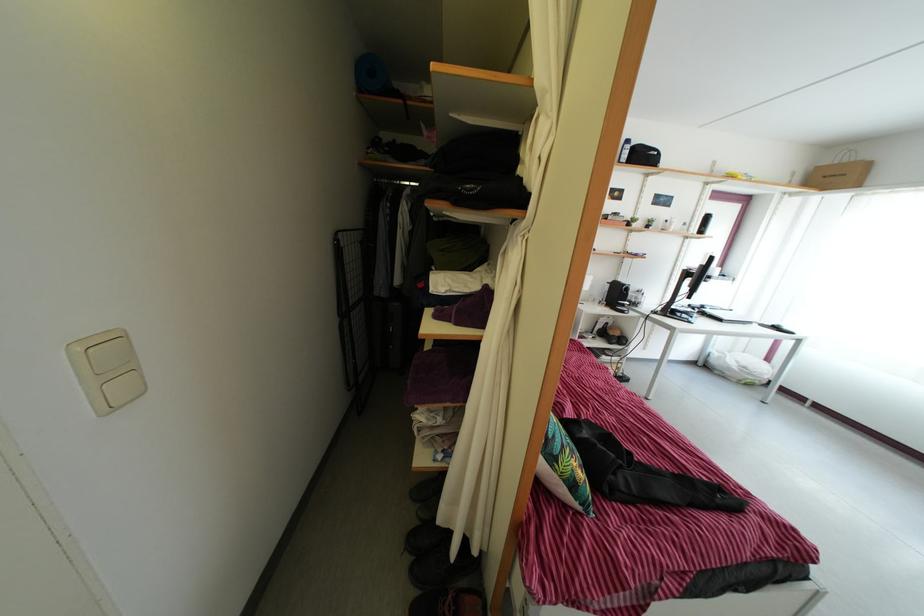
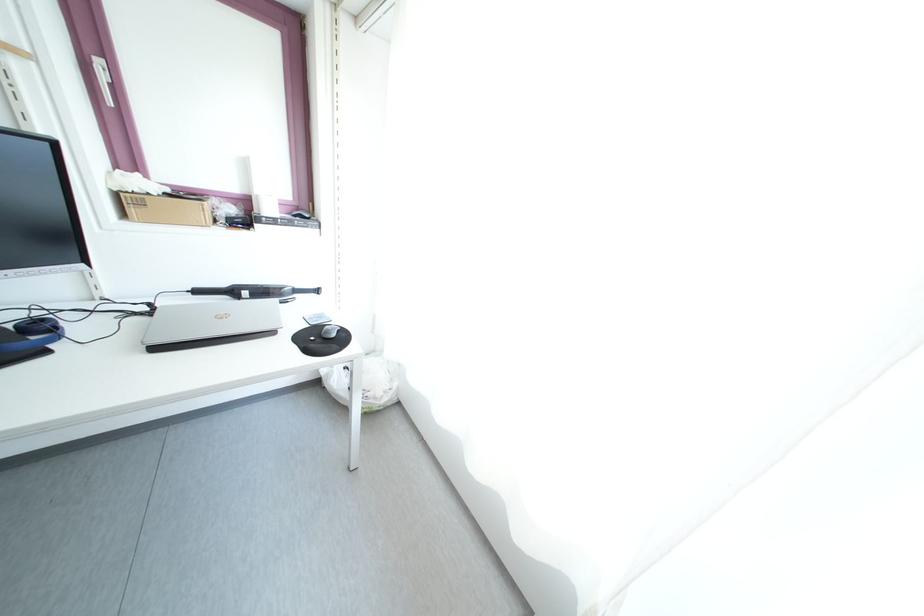
Where in the second image is the point corresponding to point 736,377 from the first image?

(344, 403)